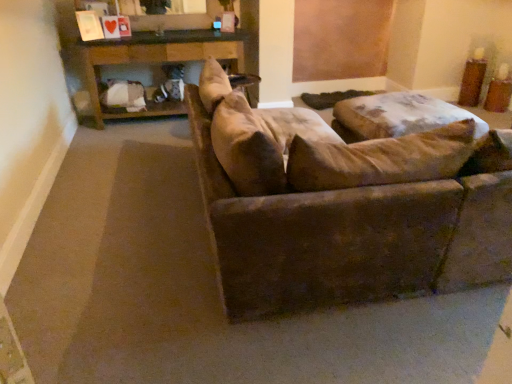
Question: Based on their sizes in the image, would you say suede brown couch at center is bigger or smaller than wooden table at upper center?

Choices:
 (A) small
 (B) big

Answer: (B)

Question: Is suede brown couch at center to the left or to the right of wooden table at upper center in the image?

Choices:
 (A) right
 (B) left

Answer: (A)

Question: Relative to wooden table at upper center, is suede brown couch at center in front or behind?

Choices:
 (A) front
 (B) behind

Answer: (A)

Question: Considering the positions of wooden table at upper center and suede brown couch at center in the image, is wooden table at upper center wider or thinner than suede brown couch at center?

Choices:
 (A) wide
 (B) thin

Answer: (B)

Question: From their relative heights in the image, would you say wooden table at upper center is taller or shorter than suede brown couch at center?

Choices:
 (A) short
 (B) tall

Answer: (A)

Question: Do you think wooden table at upper center is within suede brown couch at center, or outside of it?

Choices:
 (A) outside
 (B) inside

Answer: (A)

Question: From the image's perspective, relative to suede brown couch at center, is wooden table at upper center above or below?

Choices:
 (A) below
 (B) above

Answer: (B)